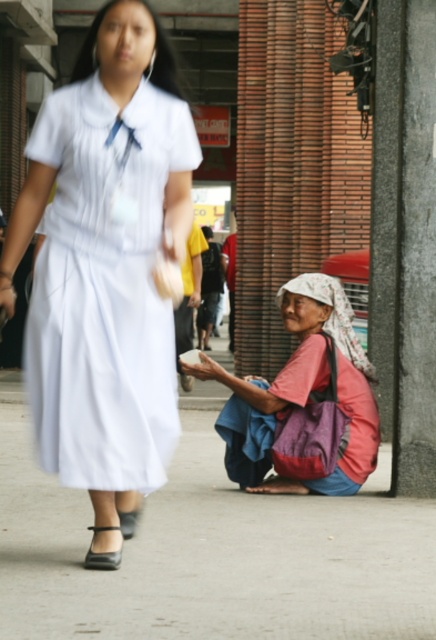
Question: Which point appears farthest from the camera in this image?

Choices:
 (A) (235, 448)
 (B) (334, 560)
 (C) (88, 561)
 (D) (77, 380)

Answer: (A)

Question: Is white pleated dress at left in front of red fabric bag at lower right?

Choices:
 (A) yes
 (B) no

Answer: (A)

Question: Which point appears closest to the camera in this image?

Choices:
 (A) (91, 568)
 (B) (194, 595)
 (C) (279, 401)
 (D) (156, 328)

Answer: (B)

Question: Which object is closer to the camera taking this photo?

Choices:
 (A) white pleated dress at left
 (B) red fabric bag at lower right
 (C) black leather sandal at lower left
 (D) smooth concrete pavement at lower center

Answer: (D)

Question: Does smooth concrete pavement at lower center appear on the right side of black leather sandal at lower left?

Choices:
 (A) yes
 (B) no

Answer: (A)

Question: Is white pleated dress at left smaller than black leather sandal at lower left?

Choices:
 (A) yes
 (B) no

Answer: (B)